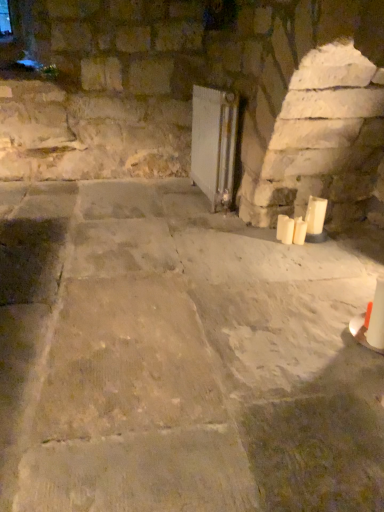
This screenshot has height=512, width=384. I want to click on white matte candle at right, which is counted as the third candle, starting from the left, so click(315, 215).

The image size is (384, 512). Describe the element at coordinates (214, 143) in the screenshot. I see `white glossy radiator at center` at that location.

Locate an element on the screen. white matte candle at right, the third candle positioned from the right is located at coordinates (285, 229).

From the image's perspective, is white glossy radiator at center above white matte candle at right, which is the 1th candle from left to right?

Yes, from the image's perspective, white glossy radiator at center is above white matte candle at right, which is the 1th candle from left to right.

Is white glossy radiator at center not inside white matte candle at right, the third candle positioned from the right?

Yes.

Which of these two, white glossy radiator at center or white matte candle at right, which is the 1th candle from left to right, is thinner?

With smaller width is white matte candle at right, which is the 1th candle from left to right.

Between white glossy radiator at center and white matte candle at right, the third candle positioned from the right, which one has less height?

With less height is white matte candle at right, the third candle positioned from the right.

Find the location of a particular element. The image size is (384, 512). fireplace above the white matte candle at lower right, the second candle in the left-to-right sequence (from the image's perspective) is located at coordinates (214, 143).

Looking at this image, which of these two, white glossy radiator at center or white matte candle at lower right, the second candle positioned from the right, is smaller?

With smaller size is white matte candle at lower right, the second candle positioned from the right.

Could you measure the distance between white glossy radiator at center and white matte candle at lower right, the second candle in the left-to-right sequence?

A distance of 33.46 inches exists between white glossy radiator at center and white matte candle at lower right, the second candle in the left-to-right sequence.

Is white matte candle at lower right, the second candle positioned from the right, next to white matte candle at right, which is the 1th candle from left to right?

Yes, white matte candle at lower right, the second candle positioned from the right, is right next to white matte candle at right, which is the 1th candle from left to right, and making contact.

Does white matte candle at lower right, the second candle positioned from the right, have a greater width compared to white matte candle at right, the third candle positioned from the right?

Correct, the width of white matte candle at lower right, the second candle positioned from the right, exceeds that of white matte candle at right, the third candle positioned from the right.

From the image's perspective, is white matte candle at lower right, the second candle in the left-to-right sequence, above or below white matte candle at right, which is the 1th candle from left to right?

white matte candle at lower right, the second candle in the left-to-right sequence, is situated lower than white matte candle at right, which is the 1th candle from left to right, in the image.

Based on their positions, is white glossy radiator at center located to the left or right of white matte candle at right, which is counted as the third candle, starting from the left?

Based on their positions, white glossy radiator at center is located to the left of white matte candle at right, which is counted as the third candle, starting from the left.

Which is less distant, (235,141) or (319,211)?

Point (235,141) is farther from the camera than point (319,211).

Does white glossy radiator at center have a greater height compared to white matte candle at right, the first candle when ordered from right to left?

Indeed, white glossy radiator at center has a greater height compared to white matte candle at right, the first candle when ordered from right to left.

From a real-world perspective, is white glossy radiator at center located higher than white matte candle at right, which is counted as the third candle, starting from the left?

Yes, from a real-world perspective, white glossy radiator at center is on top of white matte candle at right, which is counted as the third candle, starting from the left.

Can you see white matte candle at lower right, the second candle in the left-to-right sequence, touching white matte candle at right, which is counted as the third candle, starting from the left?

Yes, white matte candle at lower right, the second candle in the left-to-right sequence, is right next to white matte candle at right, which is counted as the third candle, starting from the left, and making contact.

Between white matte candle at lower right, the second candle positioned from the right, and white matte candle at right, the first candle when ordered from right to left, which one appears on the left side from the viewer's perspective?

Positioned to the left is white matte candle at lower right, the second candle positioned from the right.

Who is taller, white matte candle at lower right, the second candle positioned from the right, or white matte candle at right, which is counted as the third candle, starting from the left?

Standing taller between the two is white matte candle at right, which is counted as the third candle, starting from the left.

Considering the relative sizes of white matte candle at lower right, the second candle positioned from the right, and white matte candle at right, the first candle when ordered from right to left, in the image provided, is white matte candle at lower right, the second candle positioned from the right, smaller than white matte candle at right, the first candle when ordered from right to left,?

Yes.

In terms of height, does white matte candle at right, the first candle when ordered from right to left, look taller or shorter compared to white matte candle at right, the third candle positioned from the right?

Clearly, white matte candle at right, the first candle when ordered from right to left, is taller compared to white matte candle at right, the third candle positioned from the right.

Is white matte candle at right, which is counted as the third candle, starting from the left, positioned before white matte candle at right, which is the 1th candle from left to right?

That is True.

From the image's perspective, relative to white matte candle at right, the third candle positioned from the right, is white matte candle at right, the first candle when ordered from right to left, above or below?

Based on their image positions, white matte candle at right, the first candle when ordered from right to left, is located above white matte candle at right, the third candle positioned from the right.

Does point (324, 216) appear closer or farther from the camera than point (286, 218)?

Clearly, point (324, 216) is more distant from the camera than point (286, 218).

Is white matte candle at lower right, the second candle in the left-to-right sequence, far away from white glossy radiator at center?

They are positioned close to each other.

Is point (305, 222) positioned behind point (214, 201)?

No.

Could you measure the distance between white matte candle at lower right, the second candle in the left-to-right sequence, and white glossy radiator at center?

white matte candle at lower right, the second candle in the left-to-right sequence, is 33.46 inches away from white glossy radiator at center.

Which candle is the 1st one when counting from the right side of the white glossy radiator at center? Please provide its 2D coordinates.

[(285, 229)]

I want to click on the 3rd candle directly beneath the white glossy radiator at center (from a real-world perspective), so click(x=299, y=231).

Which object lies nearer to the anchor point white matte candle at lower right, the second candle in the left-to-right sequence, white matte candle at right, the third candle positioned from the right, or white glossy radiator at center?

Based on the image, white matte candle at right, the third candle positioned from the right, appears to be nearer to white matte candle at lower right, the second candle in the left-to-right sequence.

Which object lies nearer to the anchor point white matte candle at right, the first candle when ordered from right to left, white matte candle at right, the third candle positioned from the right, or white matte candle at lower right, the second candle in the left-to-right sequence?

Based on the image, white matte candle at lower right, the second candle in the left-to-right sequence, appears to be nearer to white matte candle at right, the first candle when ordered from right to left.

When comparing their distances from white matte candle at lower right, the second candle positioned from the right, does white matte candle at right, the first candle when ordered from right to left, or white matte candle at right, the third candle positioned from the right, seem closer?

white matte candle at right, the third candle positioned from the right, is closer to white matte candle at lower right, the second candle positioned from the right.

Which object lies nearer to the anchor point white matte candle at right, the third candle positioned from the right, white glossy radiator at center or white matte candle at right, which is counted as the third candle, starting from the left?

Based on the image, white matte candle at right, which is counted as the third candle, starting from the left, appears to be nearer to white matte candle at right, the third candle positioned from the right.

Based on their spatial positions, is white matte candle at right, the first candle when ordered from right to left, or white glossy radiator at center closer to white matte candle at lower right, the second candle positioned from the right?

Based on the image, white matte candle at right, the first candle when ordered from right to left, appears to be nearer to white matte candle at lower right, the second candle positioned from the right.

Considering their positions, is white glossy radiator at center positioned further to white matte candle at lower right, the second candle in the left-to-right sequence, than white matte candle at right, the third candle positioned from the right?

Among the two, white glossy radiator at center is located further to white matte candle at lower right, the second candle in the left-to-right sequence.

Looking at the image, which one is located closer to white glossy radiator at center, white matte candle at right, which is counted as the third candle, starting from the left, or white matte candle at right, the third candle positioned from the right?

Among the two, white matte candle at right, the third candle positioned from the right, is located nearer to white glossy radiator at center.

From the image, which object appears to be nearer to white glossy radiator at center, white matte candle at lower right, the second candle positioned from the right, or white matte candle at right, the third candle positioned from the right?

white matte candle at right, the third candle positioned from the right, lies closer to white glossy radiator at center than the other object.

This screenshot has width=384, height=512. I want to click on candle between white glossy radiator at center and white matte candle at right, the third candle positioned from the right, in the vertical direction, so click(315, 215).

Where is `candle between white matte candle at right, which is the 1th candle from left to right, and white matte candle at right, the first candle when ordered from right to left, from left to right`? This screenshot has width=384, height=512. candle between white matte candle at right, which is the 1th candle from left to right, and white matte candle at right, the first candle when ordered from right to left, from left to right is located at coordinates (299, 231).